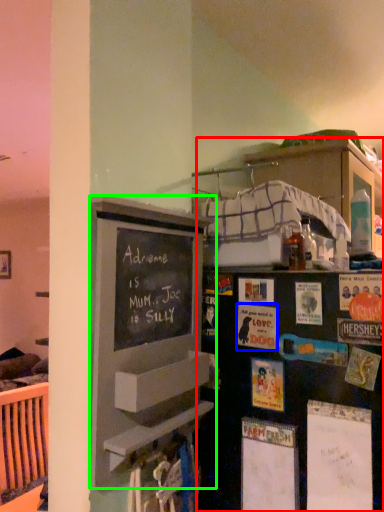
Question: Which is nearer to the bookshelf (highlighted by a red box)? postcard (highlighted by a blue box) or bulletin board (highlighted by a green box).

Choices:
 (A) postcard
 (B) bulletin board

Answer: (B)